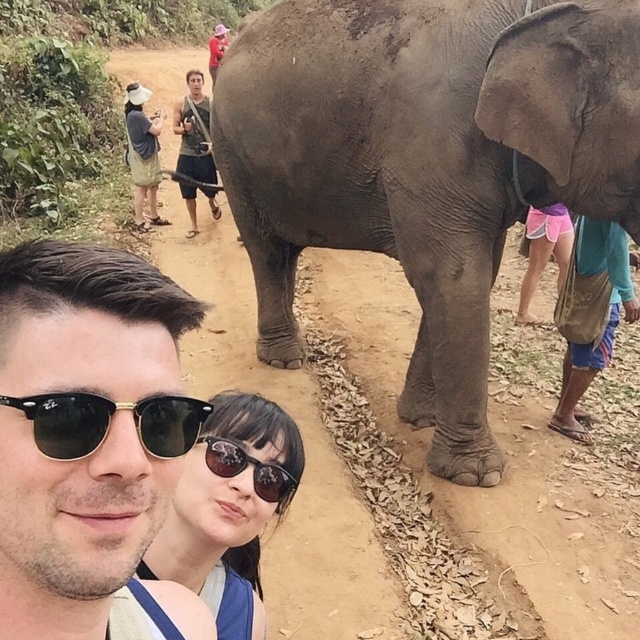
Is point (170, 564) behind point (141, 426)?

Yes, it is.

Does point (273, 477) come closer to viewer compared to point (106, 416)?

No, (273, 477) is further to viewer.

The height and width of the screenshot is (640, 640). I want to click on sunglasses at center, so click(x=228, y=509).

Who is more distant from viewer, [586,330] or [198,74]?

The point [198,74] is behind.

This screenshot has width=640, height=640. Describe the element at coordinates (589, 314) in the screenshot. I see `pink fabric shorts at lower right` at that location.

Does point (570, 296) come behind point (186, 132)?

No.

Find the location of a particular element. pink fabric shorts at lower right is located at coordinates (589, 314).

What do you see at coordinates (84, 428) in the screenshot? The image size is (640, 640). I see `matte black sunglasses at center` at bounding box center [84, 428].

Identify the location of matte black sunglasses at center. point(84,428).